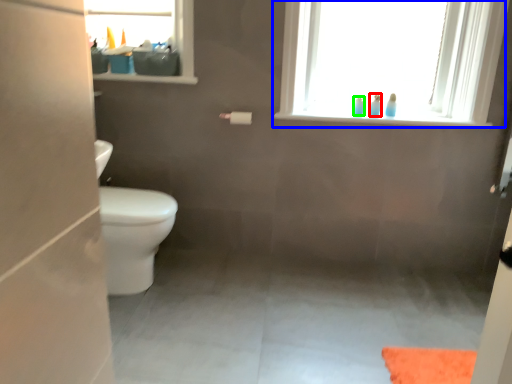
Question: Considering the real-world distances, which object is farthest from toiletry (highlighted by a red box)? window (highlighted by a blue box) or toiletry (highlighted by a green box)?

Choices:
 (A) window
 (B) toiletry

Answer: (A)